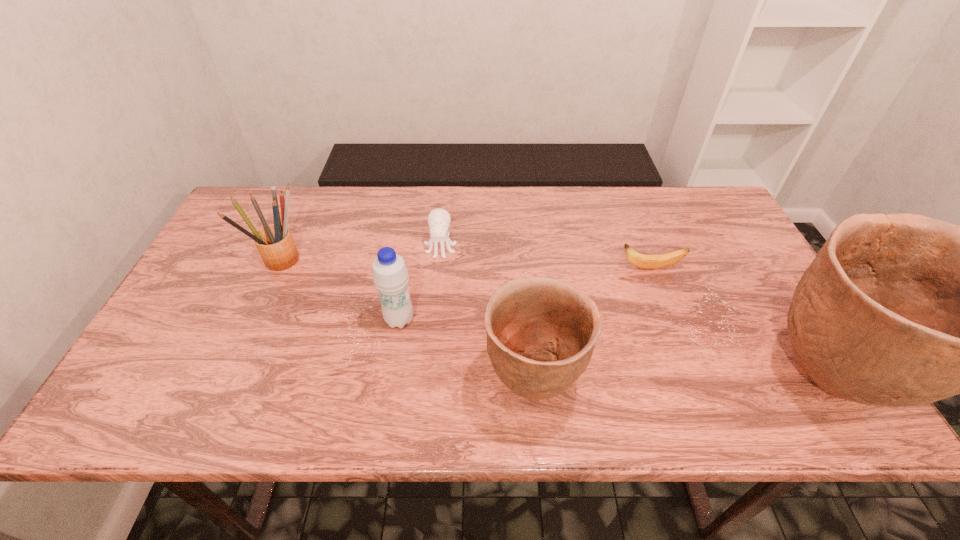
Locate an element on the screen. The width and height of the screenshot is (960, 540). free region located on the left of the taller pottery is located at coordinates (583, 379).

The height and width of the screenshot is (540, 960). I want to click on free region located on the front-facing side of the fifth tallest object, so click(x=436, y=301).

I want to click on vacant space located 0.360m at the stem of the shortest object, so click(487, 268).

At what (x,y) coordinates should I click in order to perform the action: click on vacant point located 0.060m at the stem of the shortest object. Please return your answer as a coordinate pair (x, y). Looking at the image, I should click on (596, 268).

Image resolution: width=960 pixels, height=540 pixels. In order to click on free point located at the stem of the shortest object in this screenshot , I will do `click(560, 268)`.

At what (x,y) coordinates should I click in order to perform the action: click on free region located 0.130m on the back of the water bottle. Please return your answer as a coordinate pair (x, y). The height and width of the screenshot is (540, 960). Looking at the image, I should click on (407, 271).

Image resolution: width=960 pixels, height=540 pixels. Identify the location of vacant area situated on the front of the pencil box. (252, 333).

At what (x,y) coordinates should I click in order to perform the action: click on object present at the left edge. Please return your answer as a coordinate pair (x, y). This screenshot has height=540, width=960. Looking at the image, I should click on (274, 242).

The width and height of the screenshot is (960, 540). I want to click on object that is at the right edge, so click(896, 310).

At what (x,y) coordinates should I click in order to perform the action: click on object that is at the near right corner. Please return your answer as a coordinate pair (x, y). Looking at the image, I should click on click(x=896, y=310).